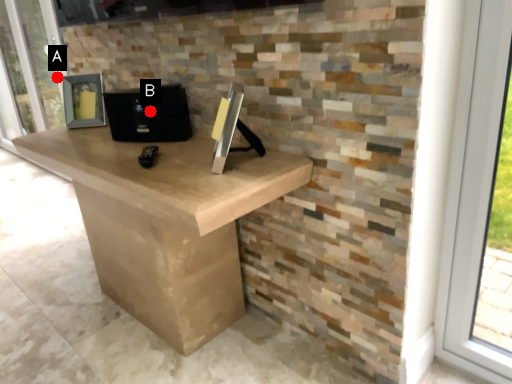
Question: Two points are circled on the image, labeled by A and B beside each circle. Which point is farther to the camera?

Choices:
 (A) A is further
 (B) B is further

Answer: (A)